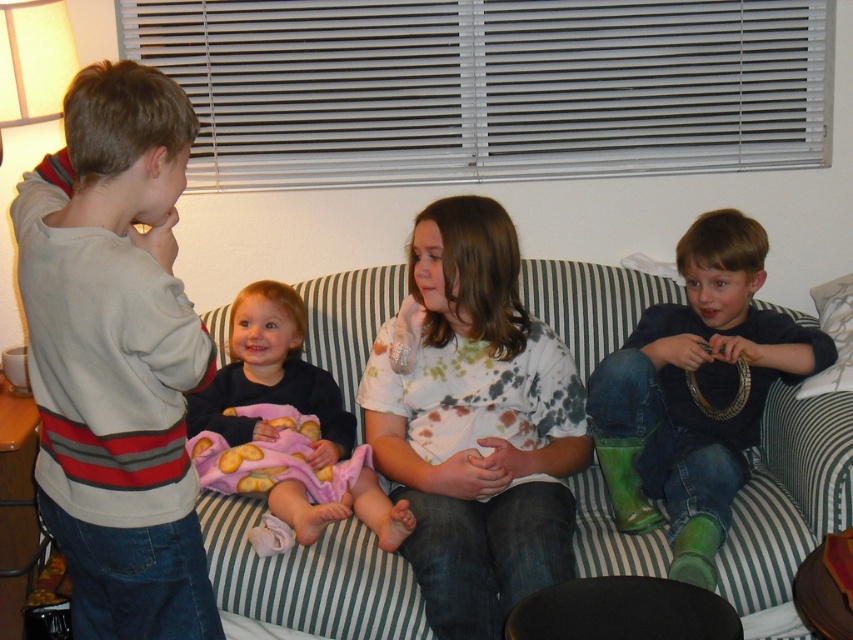
Question: Is green striped couch at center thinner than pink fleece blanket at center?

Choices:
 (A) yes
 (B) no

Answer: (B)

Question: Does green rubber boots at right appear under pink fleece blanket at center?

Choices:
 (A) no
 (B) yes

Answer: (A)

Question: Among these points, which one is nearest to the camera?

Choices:
 (A) (599, 557)
 (B) (491, 467)

Answer: (A)

Question: Which object is farther from the camera taking this photo?

Choices:
 (A) green rubber boots at right
 (B) pink fleece blanket at center
 (C) gray striped sweater at left
 (D) green striped couch at center

Answer: (B)

Question: Is the position of green striped couch at center less distant than that of pink fleece blanket at center?

Choices:
 (A) no
 (B) yes

Answer: (B)

Question: Which is nearer to the pink fleece blanket at center?

Choices:
 (A) tie-dye fabric shirt at center
 (B) green rubber boots at right
 (C) gray striped sweater at left
 (D) green striped couch at center

Answer: (A)